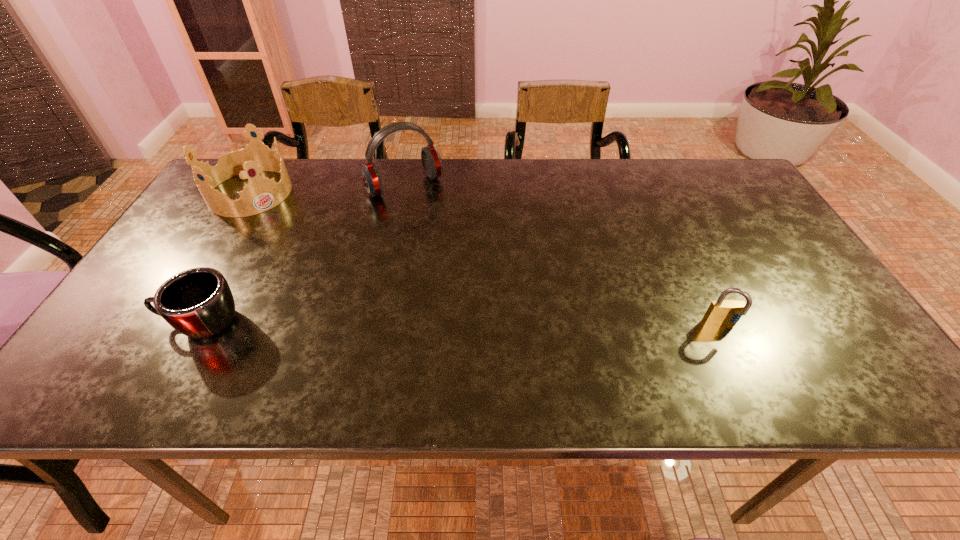
Where is `vacant space situated on the front-facing side of the tiara`? Image resolution: width=960 pixels, height=540 pixels. vacant space situated on the front-facing side of the tiara is located at coordinates (297, 237).

This screenshot has width=960, height=540. In order to click on vacant space located 0.380m on the front-facing side of the tiara in this screenshot , I will do `click(342, 280)`.

You are a GUI agent. You are given a task and a screenshot of the screen. Output one action in this format:
    pyautogui.click(x=<x>, y=<y>)
    Task: Click on the earphone that is at the far edge
    The height and width of the screenshot is (540, 960).
    Given the screenshot: What is the action you would take?
    pyautogui.click(x=432, y=163)

Locate an element on the screen. Image resolution: width=960 pixels, height=540 pixels. tiara at the far edge is located at coordinates (261, 194).

Locate an element on the screen. This screenshot has width=960, height=540. mug at the near edge is located at coordinates (198, 302).

The height and width of the screenshot is (540, 960). Identify the location of padlock that is at the near edge. (722, 312).

This screenshot has height=540, width=960. Find the location of `mug that is at the left edge`. mug that is at the left edge is located at coordinates (198, 302).

Where is `tiara positioned at the left edge`? tiara positioned at the left edge is located at coordinates (261, 194).

Identify the location of object that is positioned at the far left corner. (261, 194).

I want to click on object at the near left corner, so click(x=198, y=302).